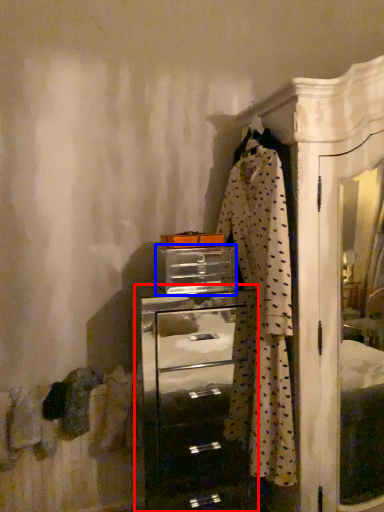
Question: Which object appears farthest to the camera in this image, chest of drawers (highlighted by a red box) or drawer (highlighted by a blue box)?

Choices:
 (A) chest of drawers
 (B) drawer

Answer: (B)